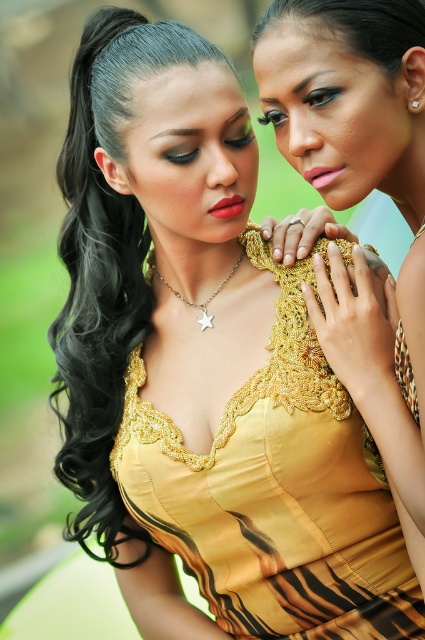
Consider the image. Is pink matte lipstick at center to the right of diamondelegant metal at upper right from the viewer's perspective?

Incorrect, pink matte lipstick at center is not on the right side of diamondelegant metal at upper right.

Looking at this image, does pink matte lipstick at center have a larger size compared to diamondelegant metal at upper right?

Yes.

Is point (328, 182) positioned before point (414, 100)?

No, it is behind (414, 100).

This screenshot has height=640, width=425. I want to click on pink matte lipstick at center, so click(x=322, y=176).

Is point (243, 198) closer to viewer compared to point (418, 100)?

No.

Between matte pink lipstick at center and diamondelegant metal at upper right, which one has more height?

matte pink lipstick at center

Who is more forward, (221, 216) or (414, 100)?

Point (414, 100) is more forward.

Where is `matte pink lipstick at center`? The width and height of the screenshot is (425, 640). matte pink lipstick at center is located at coordinates (227, 205).

Can you confirm if gold metallic star at center is positioned above pink matte lipstick at center?

Actually, gold metallic star at center is below pink matte lipstick at center.

Can you confirm if gold metallic star at center is positioned to the right of pink matte lipstick at center?

No, gold metallic star at center is not to the right of pink matte lipstick at center.

Does point (215, 289) come closer to viewer compared to point (311, 172)?

No, (215, 289) is further to viewer.

At what (x,y) coordinates should I click in order to perform the action: click on gold metallic star at center. Please return your answer as a coordinate pair (x, y). The width and height of the screenshot is (425, 640). Looking at the image, I should click on (192, 301).